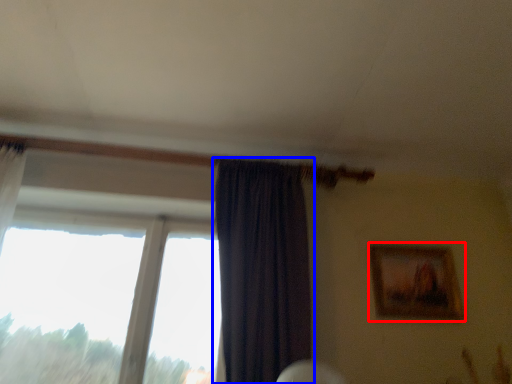
Question: Which object is closer to the camera taking this photo, picture frame (highlighted by a red box) or curtain (highlighted by a blue box)?

Choices:
 (A) picture frame
 (B) curtain

Answer: (B)